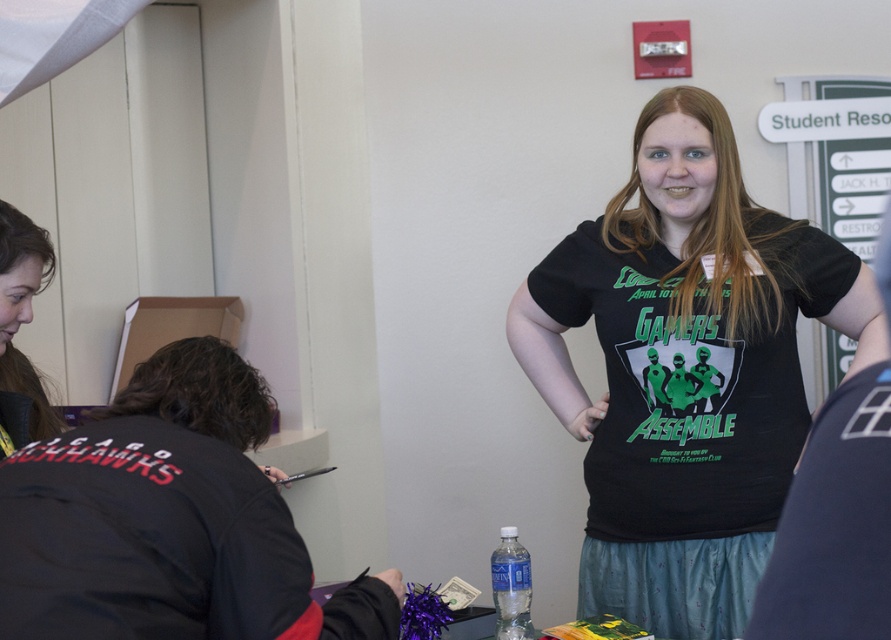
You are a photographer taking a photo of the black matte shirt at center and brown hair at left. Which object should you focus on first if you want to capture both clearly in the frame?

The black matte shirt at center has a larger size compared to brown hair at left, so you should focus on the black matte shirt at center first to ensure both are in focus.